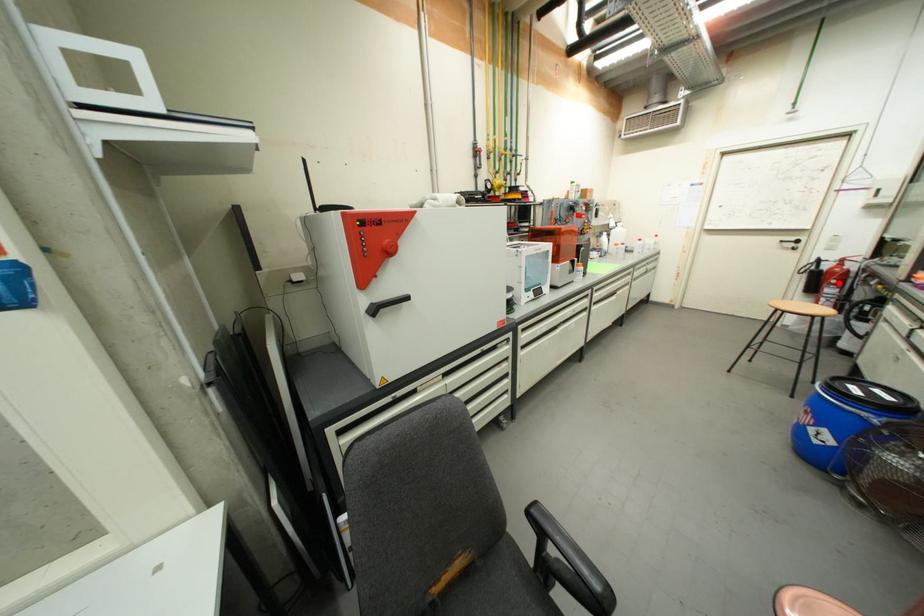
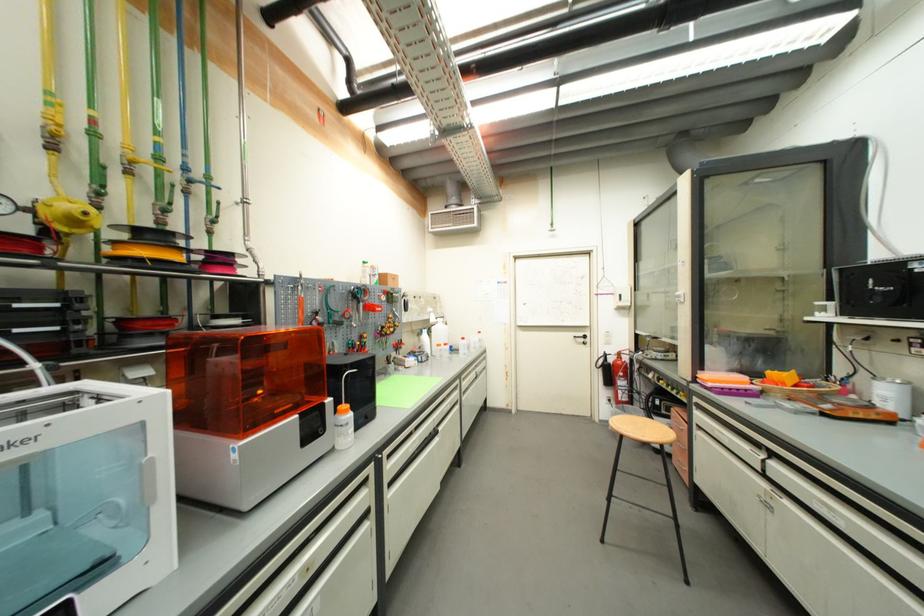
Question: A red point is marked in image1. In image2, is the corresponding 3D point closer to the camera or farther? Reply with the corresponding letter.

Choices:
 (A) The corresponding 3D point is closer.
 (B) The corresponding 3D point is farther.

Answer: (A)